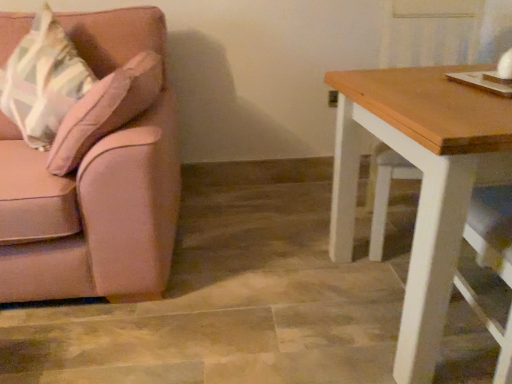
Question: In the image, is matte pink throw pillow at left on the left side or the right side of pink fabric couch at left?

Choices:
 (A) left
 (B) right

Answer: (B)

Question: Is matte pink throw pillow at left situated inside pink fabric couch at left or outside?

Choices:
 (A) outside
 (B) inside

Answer: (B)

Question: Estimate the real-world distances between objects in this image. Which object is closer to the pink fabric couch at left?

Choices:
 (A) wooden table at right
 (B) matte pink throw pillow at left

Answer: (B)

Question: Which object is positioned closest to the wooden table at right?

Choices:
 (A) matte pink throw pillow at left
 (B) pink fabric couch at left

Answer: (B)